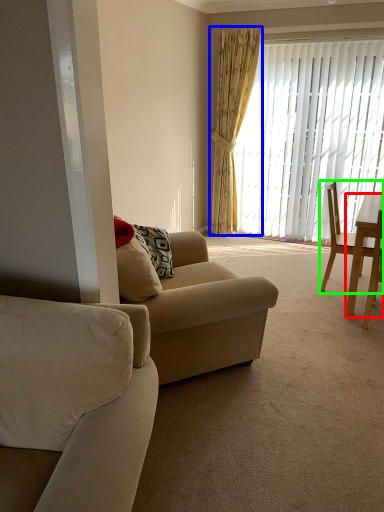
Question: Considering the real-world distances, which object is closest to desk (highlighted by a red box)? curtain (highlighted by a blue box) or chair (highlighted by a green box).

Choices:
 (A) curtain
 (B) chair

Answer: (B)